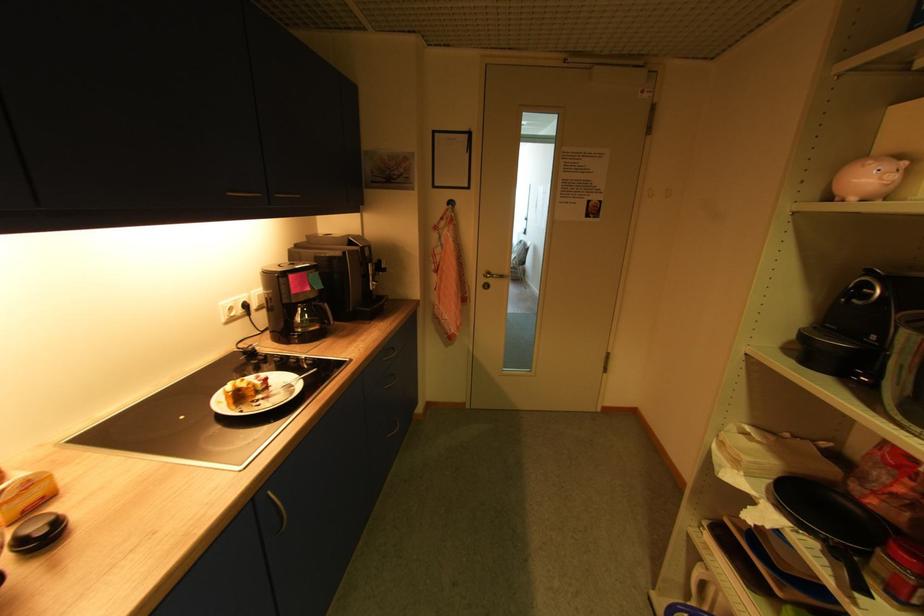
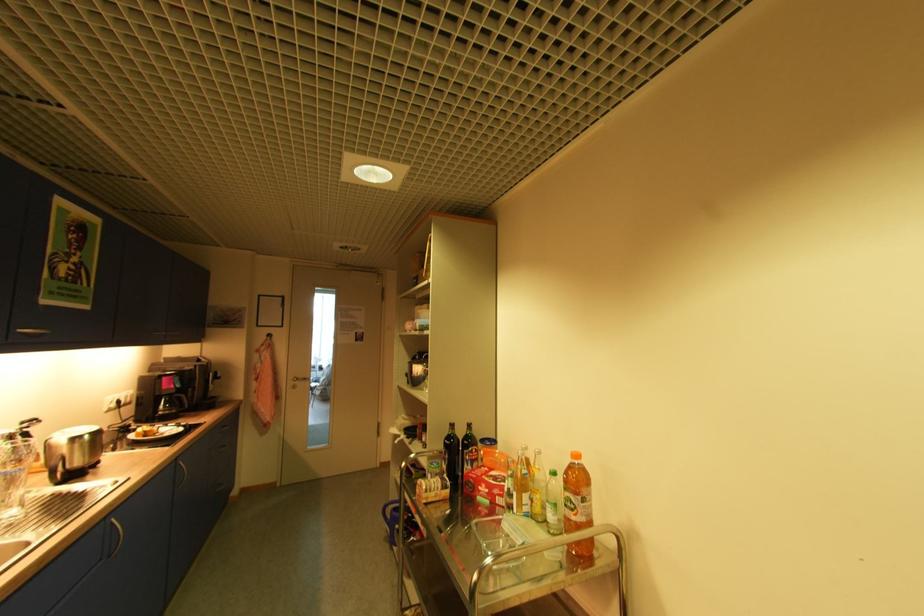
In the second image, find the point that corresponds to point (318, 296) in the first image.

(178, 392)